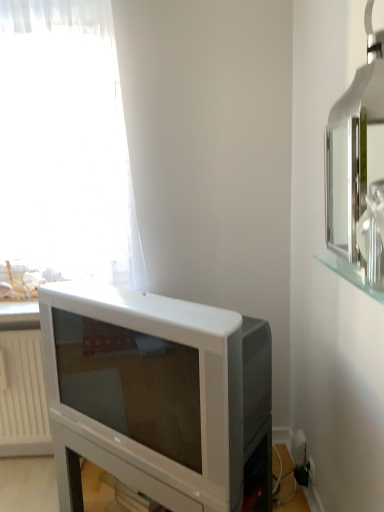
Question: Is silver metallic medicine cabinet at upper right oriented away from white plastic radiator at lower left?

Choices:
 (A) yes
 (B) no

Answer: (B)

Question: From the image's perspective, is silver metallic medicine cabinet at upper right on white plastic radiator at lower left?

Choices:
 (A) no
 (B) yes

Answer: (B)

Question: Does silver metallic medicine cabinet at upper right have a larger size compared to white plastic radiator at lower left?

Choices:
 (A) no
 (B) yes

Answer: (B)

Question: Is silver metallic medicine cabinet at upper right next to white plastic radiator at lower left?

Choices:
 (A) yes
 (B) no

Answer: (B)

Question: Considering the relative sizes of silver metallic medicine cabinet at upper right and white plastic radiator at lower left in the image provided, is silver metallic medicine cabinet at upper right thinner than white plastic radiator at lower left?

Choices:
 (A) yes
 (B) no

Answer: (B)

Question: Is point (175, 359) positioned closer to the camera than point (41, 379)?

Choices:
 (A) farther
 (B) closer

Answer: (B)

Question: Considering the positions of white plastic television at lower left and white plastic radiator at lower left in the image, is white plastic television at lower left wider or thinner than white plastic radiator at lower left?

Choices:
 (A) thin
 (B) wide

Answer: (B)

Question: Is white plastic television at lower left inside or outside of white plastic radiator at lower left?

Choices:
 (A) outside
 (B) inside

Answer: (A)

Question: From a real-world perspective, relative to white plastic radiator at lower left, is white plastic television at lower left vertically above or below?

Choices:
 (A) above
 (B) below

Answer: (A)

Question: In the image, is white plastic radiator at lower left positioned in front of or behind white sheer curtain at upper left?

Choices:
 (A) front
 (B) behind

Answer: (B)

Question: From a real-world perspective, is white plastic radiator at lower left above or below white sheer curtain at upper left?

Choices:
 (A) below
 (B) above

Answer: (A)

Question: In terms of height, does white plastic radiator at lower left look taller or shorter compared to white sheer curtain at upper left?

Choices:
 (A) tall
 (B) short

Answer: (B)

Question: Considering the positions of point (3, 446) and point (39, 254), is point (3, 446) closer or farther from the camera than point (39, 254)?

Choices:
 (A) farther
 (B) closer

Answer: (A)

Question: From a real-world perspective, is silver metallic medicine cabinet at upper right above or below white plastic radiator at lower left?

Choices:
 (A) above
 (B) below

Answer: (A)

Question: In terms of height, does silver metallic medicine cabinet at upper right look taller or shorter compared to white plastic radiator at lower left?

Choices:
 (A) tall
 (B) short

Answer: (B)